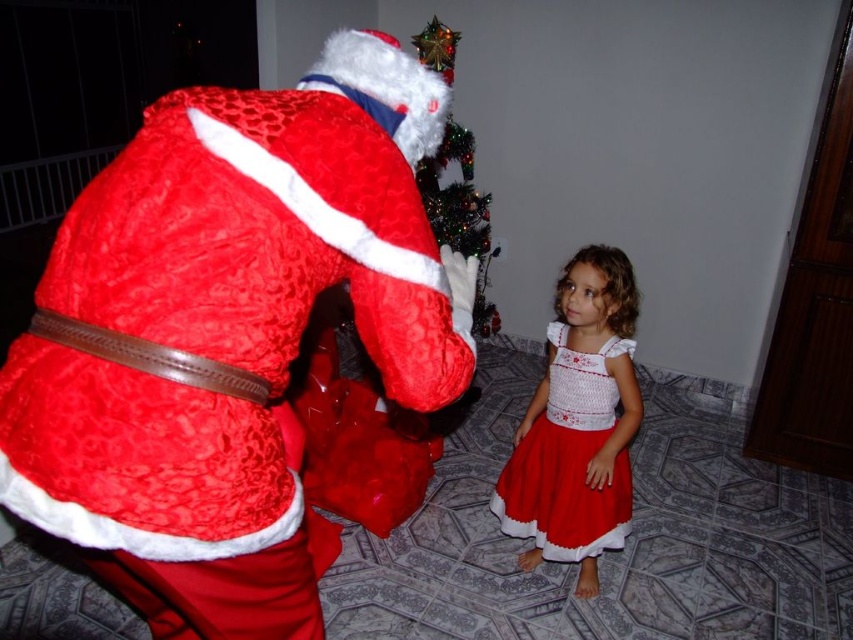
Question: Among these objects, which one is nearest to the camera?

Choices:
 (A) white crochet dress at lower right
 (B) velvet red santa claus at upper left

Answer: (B)

Question: Which of the following is the farthest from the observer?

Choices:
 (A) (180, 612)
 (B) (482, 202)
 (C) (500, 506)

Answer: (B)

Question: Considering the real-world distances, which object is farthest from the green glittery christmas tree at upper center?

Choices:
 (A) velvet red santa claus at upper left
 (B) white crochet dress at lower right

Answer: (A)

Question: Can you confirm if white crochet dress at lower right is bigger than green glittery christmas tree at upper center?

Choices:
 (A) no
 (B) yes

Answer: (A)

Question: Is velvet red santa claus at upper left closer to the viewer compared to green glittery christmas tree at upper center?

Choices:
 (A) no
 (B) yes

Answer: (B)

Question: Observing the image, what is the correct spatial positioning of white crochet dress at lower right in reference to green glittery christmas tree at upper center?

Choices:
 (A) below
 (B) above

Answer: (A)